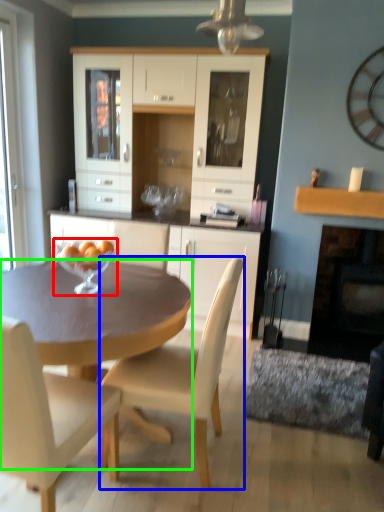
Question: Based on their relative distances, which object is nearer to wine glass (highlighted by a red box)? Choose from chair (highlighted by a blue box) and desk (highlighted by a green box).

Choices:
 (A) chair
 (B) desk

Answer: (B)